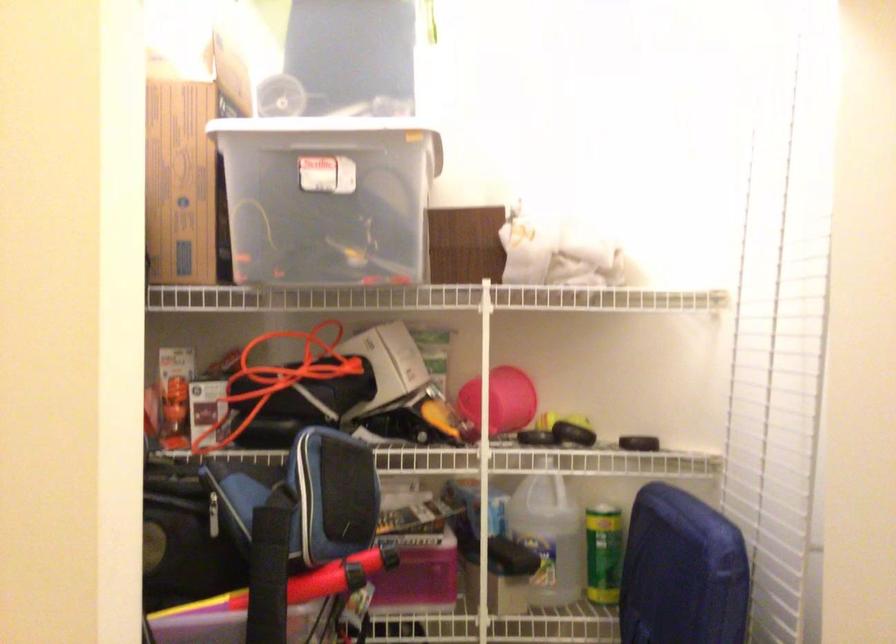
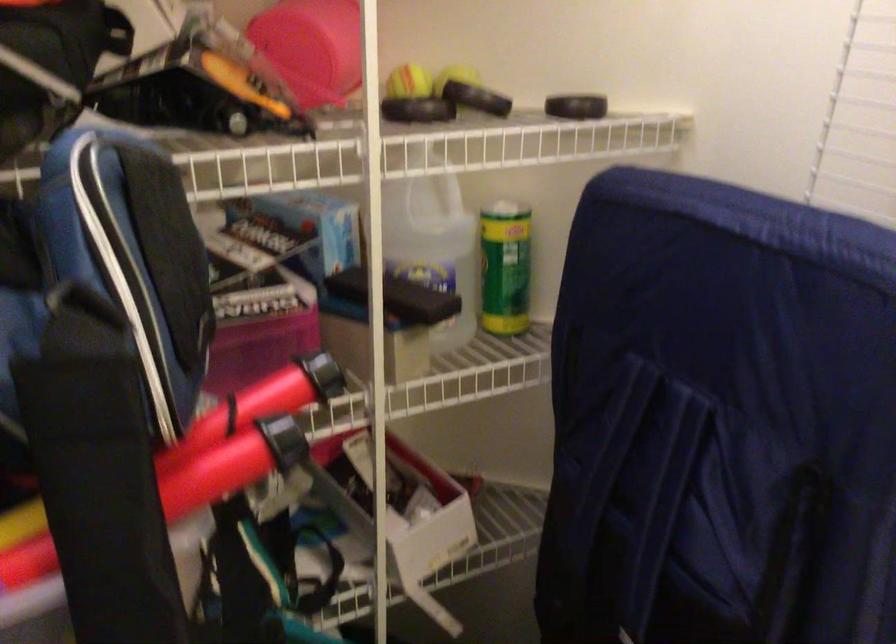
Locate, in the second image, the point that corresponds to the point at 486,402 in the first image.

(312, 48)